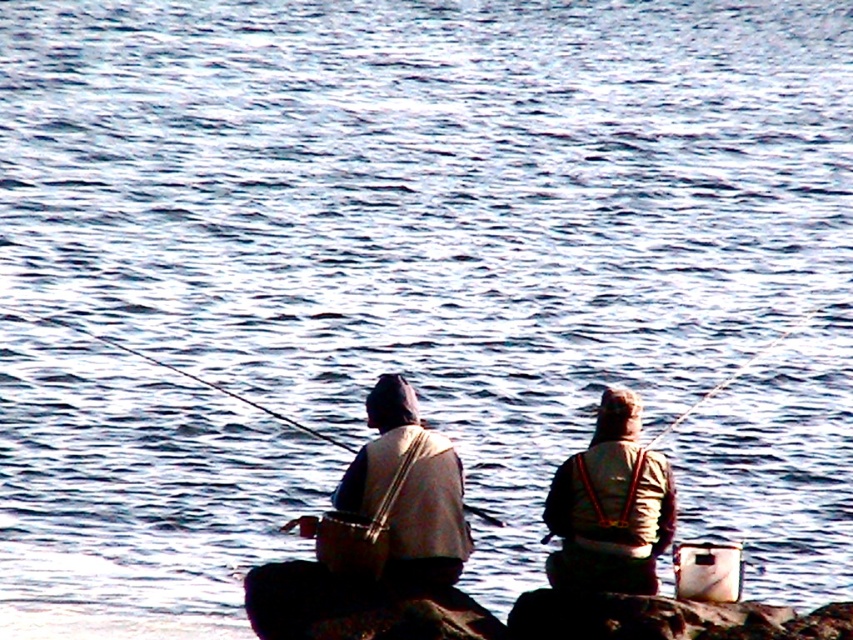
You are a hiker who wants to find the camouflage fabric jacket at center. You see a point marked at coordinate (x=610, y=506). Is the camouflage fabric jacket at center located at that point?

Yes, the point at coordinate (x=610, y=506) marks the camouflage fabric jacket at center.

You are a photographer trying to capture the perfect shot of the camouflage fabric jacket at center and the smooth plastic fishing pole at center. To ensure both are in frame, you need to know their relative positions. Which object is positioned to the right side of the other?

The camouflage fabric jacket at center is to the right of the smooth plastic fishing pole at center.

You are a photographer planning to take a closeup shot of the camouflage fabric jacket at center and the smooth plastic fishing pole at center. The camera you are using has a maximum focus range of 10 feet. Can you capture both objects in focus without moving the camera?

The distance between the camouflage fabric jacket at center and the smooth plastic fishing pole at center is 10.42 feet. Since the camera can only focus within 10 feet, it cannot capture both objects in focus without moving the camera.